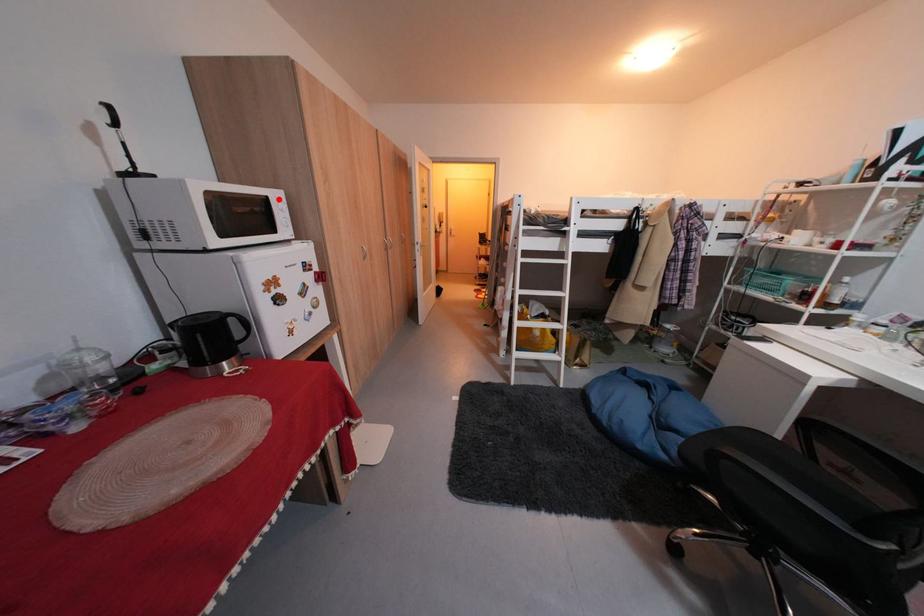
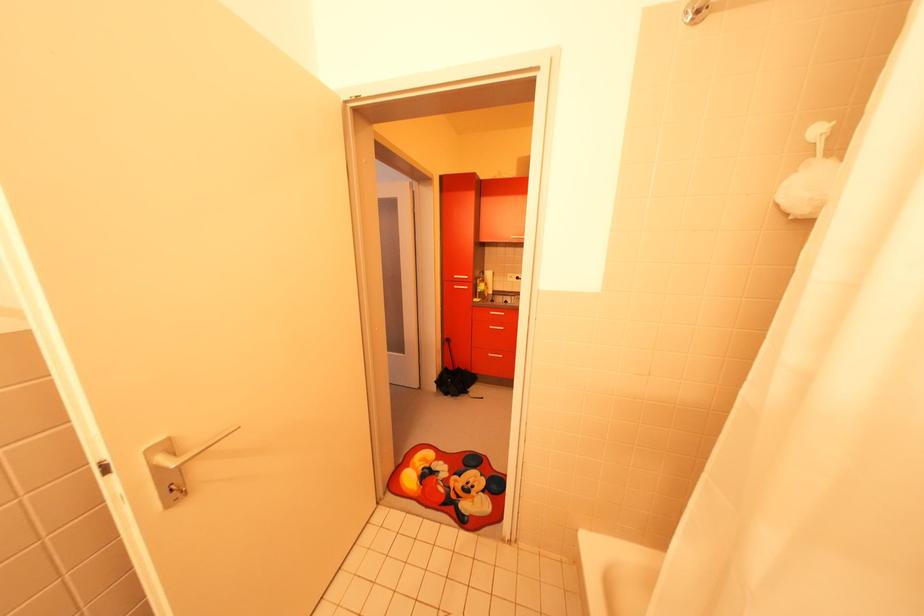
Question: I am providing you with two images of the same scene from different viewpoints. A red point is marked on the first image. Can you still see the location of the red point in image 2?

Choices:
 (A) Yes
 (B) No

Answer: (B)